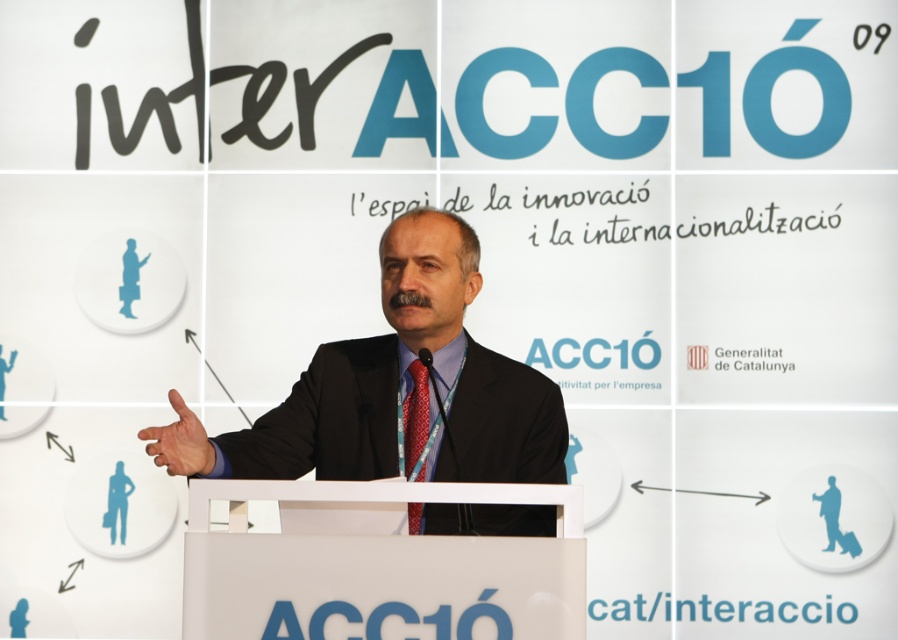
You are attending a conference and see two points marked in the image. Which point is closer to you, point (322, 477) or point (417, 528)?

Point (417, 528) is closer to you because it is less further to the camera than point (322, 477).

You are an event organizer who needs to ensure all attire elements are visible in the conference photos. Given that the black suit at center and the red silk tie at center are part of the speaker attire, which one is taller?

The black suit at center is taller than the red silk tie at center, so the suit will be more visible in the photos.

From the picture: You are attending a conference and notice a speaker wearing a black suit at center and a red silk tie at center. Which item is positioned closer to you?

The black suit at center is closer to the viewer than the red silk tie at center.